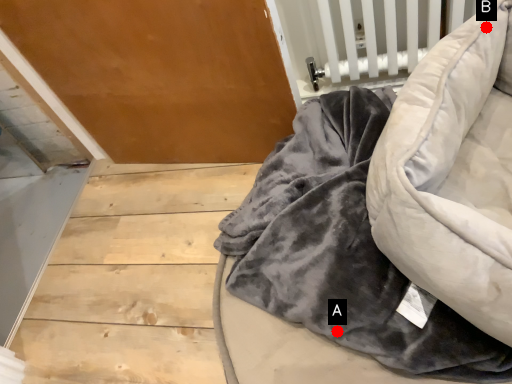
Question: Two points are circled on the image, labeled by A and B beside each circle. Among these points, which one is nearest to the camera?

Choices:
 (A) A is closer
 (B) B is closer

Answer: (A)